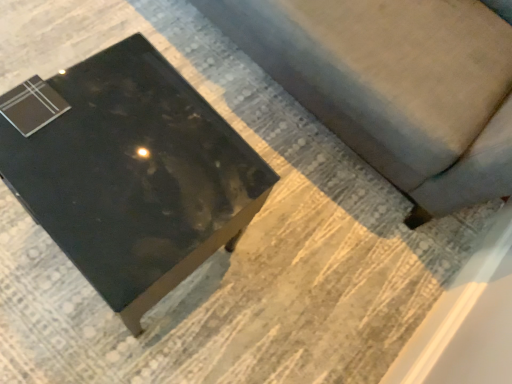
Question: From the image's perspective, is suede-like gray couch at lower right beneath glossy black table at lower left?

Choices:
 (A) no
 (B) yes

Answer: (A)

Question: Is suede-like gray couch at lower right to the left of glossy black table at lower left from the viewer's perspective?

Choices:
 (A) yes
 (B) no

Answer: (B)

Question: Does suede-like gray couch at lower right turn towards glossy black table at lower left?

Choices:
 (A) yes
 (B) no

Answer: (A)

Question: Is suede-like gray couch at lower right smaller than glossy black table at lower left?

Choices:
 (A) no
 (B) yes

Answer: (A)

Question: From a real-world perspective, is suede-like gray couch at lower right on glossy black table at lower left?

Choices:
 (A) no
 (B) yes

Answer: (B)

Question: Is suede-like gray couch at lower right wider than glossy black table at lower left?

Choices:
 (A) no
 (B) yes

Answer: (B)

Question: Considering the relative positions of glossy black table at lower left and suede-like gray couch at lower right in the image provided, is glossy black table at lower left to the left of suede-like gray couch at lower right from the viewer's perspective?

Choices:
 (A) no
 (B) yes

Answer: (B)

Question: Considering the relative positions of glossy black table at lower left and suede-like gray couch at lower right in the image provided, is glossy black table at lower left behind suede-like gray couch at lower right?

Choices:
 (A) no
 (B) yes

Answer: (B)

Question: Does glossy black table at lower left have a greater width compared to suede-like gray couch at lower right?

Choices:
 (A) yes
 (B) no

Answer: (B)

Question: Does glossy black table at lower left have a smaller size compared to suede-like gray couch at lower right?

Choices:
 (A) yes
 (B) no

Answer: (A)

Question: Considering the relative sizes of glossy black table at lower left and suede-like gray couch at lower right in the image provided, is glossy black table at lower left shorter than suede-like gray couch at lower right?

Choices:
 (A) no
 (B) yes

Answer: (B)

Question: Can you see glossy black table at lower left touching suede-like gray couch at lower right?

Choices:
 (A) yes
 (B) no

Answer: (B)

Question: From the image's perspective, is glossy black table at lower left above or below suede-like gray couch at lower right?

Choices:
 (A) below
 (B) above

Answer: (A)